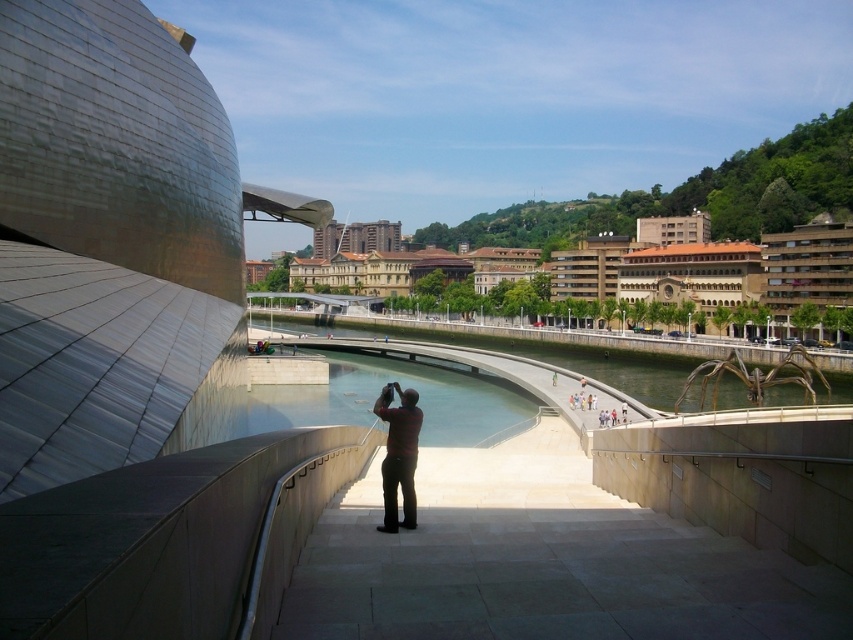
You are standing at the curved walkway leading to the water and want to take a photo of the brown stone buildings at center. Based on their position, where should you aim your camera to capture them in the frame?

You should aim your camera at point [711,266] to capture the brown stone buildings at center in the frame.

You are standing on the walkway and want to take a photo of the clear glass waterway at center and the dark red shirt at center. Which object is taller in the image?

The clear glass waterway at center is taller than the dark red shirt at center.